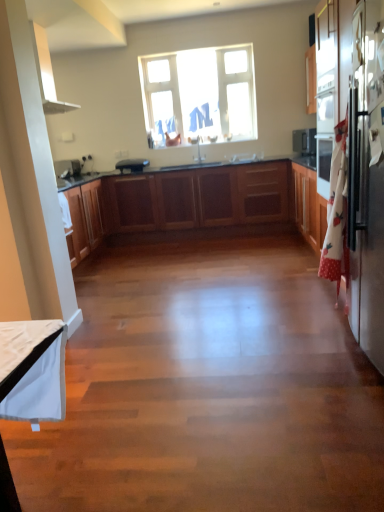
The image size is (384, 512). What are the coordinates of `blank space to the left of sleek stainless steel refrigerator at right` in the screenshot? It's located at (266, 377).